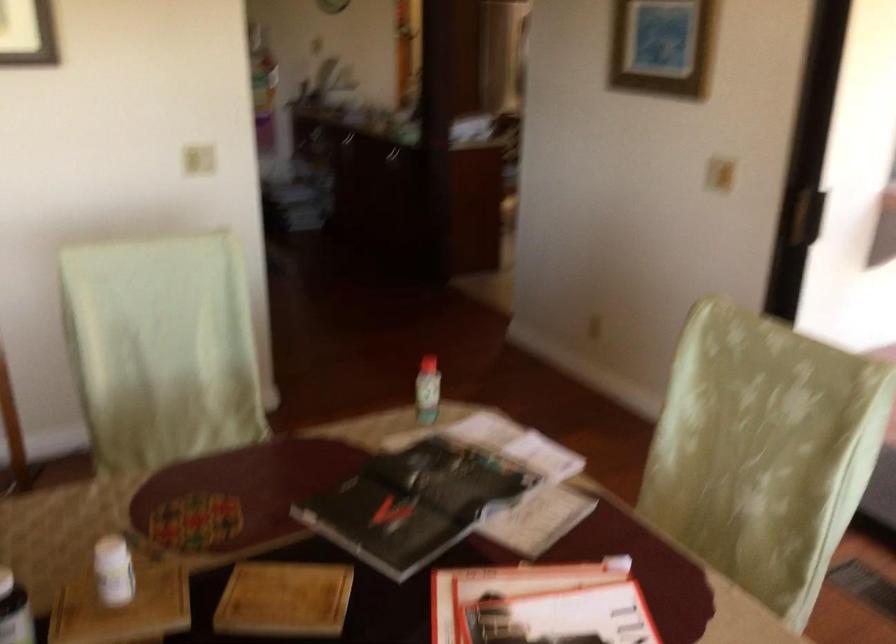
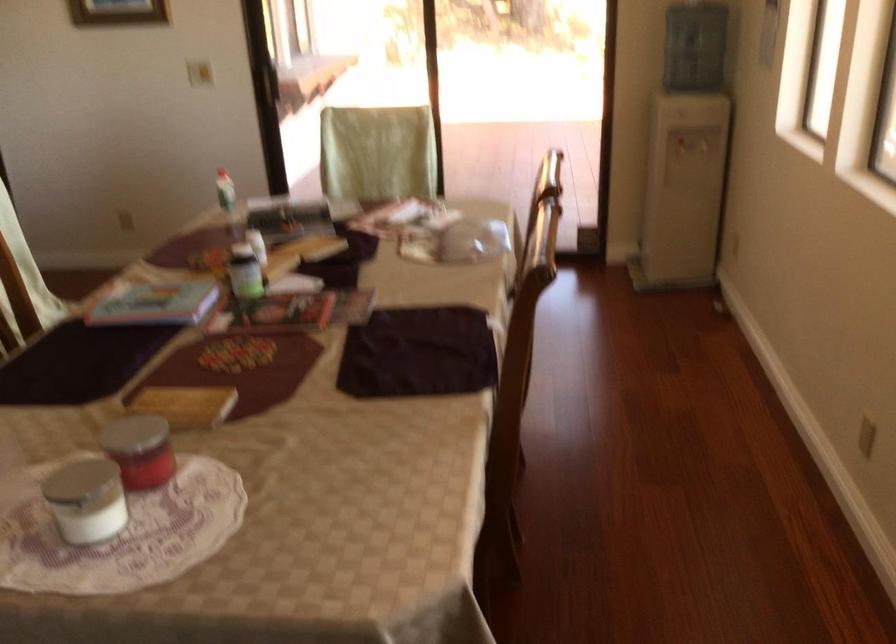
In the second image, find the point that corresponds to point 427,399 in the first image.

(225, 190)